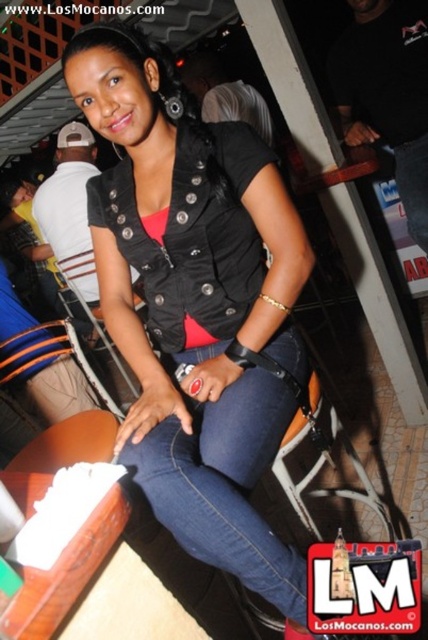
Is black matte vest at center shorter than denim jeans at center?

No, black matte vest at center is not shorter than denim jeans at center.

Locate an element on the screen. black matte vest at center is located at coordinates (196, 304).

Based on the photo, is black matte vest at center below metallic silver chair at center?

No, black matte vest at center is not below metallic silver chair at center.

Between point (279, 193) and point (89, 378), which one is positioned behind?

The point (89, 378) is more distant.

Where is `black matte vest at center`? This screenshot has height=640, width=428. black matte vest at center is located at coordinates (196, 304).

Is black matte vest at center wider than metallic silver chair at lower center?

Correct, the width of black matte vest at center exceeds that of metallic silver chair at lower center.

Measure the distance between point [140,355] and camera.

Point [140,355] is 1.34 meters from camera.

Identify the location of black matte vest at center. The image size is (428, 640). (196, 304).